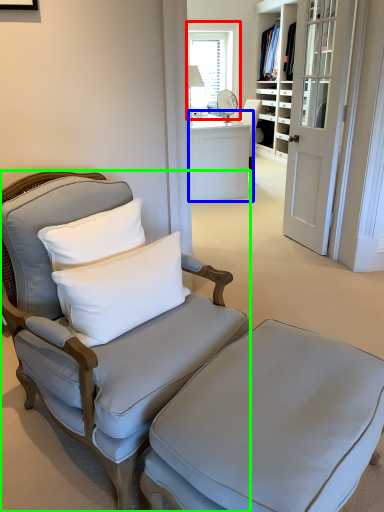
Question: Estimate the real-world distances between objects in this image. Which object is farther from window (highlighted by a red box), desk (highlighted by a blue box) or chair (highlighted by a green box)?

Choices:
 (A) desk
 (B) chair

Answer: (B)